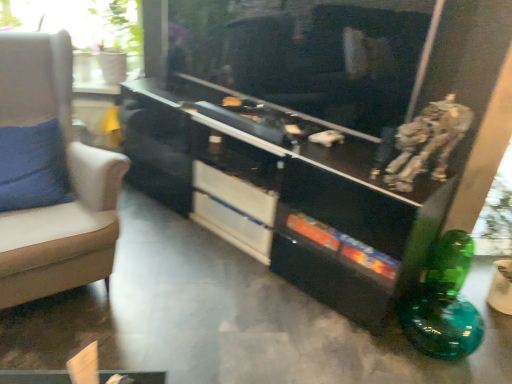
Describe the element at coordinates (85, 31) in the screenshot. I see `transparent glass window at upper left` at that location.

The height and width of the screenshot is (384, 512). What do you see at coordinates (234, 193) in the screenshot?
I see `white glossy drawer at center, which is the first drawer from top to bottom` at bounding box center [234, 193].

This screenshot has width=512, height=384. Identify the location of white glossy drawer at center, arranged as the first drawer when ordered from the bottom. (233, 226).

From a real-world perspective, is transparent glass window at upper left positioned above or below white glossy drawer at center, arranged as the first drawer when ordered from the bottom?

Clearly, from a real-world perspective, transparent glass window at upper left is above white glossy drawer at center, arranged as the first drawer when ordered from the bottom.

Is transparent glass window at upper left completely or partially outside of white glossy drawer at center, arranged as the first drawer when ordered from the bottom?

Yes, transparent glass window at upper left is not within white glossy drawer at center, arranged as the first drawer when ordered from the bottom.

Is transparent glass window at upper left at the right side of white glossy drawer at center, the second drawer viewed from the top?

No.

Does black glossy entertainment center at center turn towards white glossy drawer at center, which is the first drawer from top to bottom?

Yes.

Choose the correct answer: Is black glossy entertainment center at center inside white glossy drawer at center, which is the first drawer from top to bottom, or outside it?

black glossy entertainment center at center is spatially situated outside white glossy drawer at center, which is the first drawer from top to bottom.

Is black glossy entertainment center at center touching white glossy drawer at center, arranged as the 2th drawer when ordered from the bottom?

black glossy entertainment center at center is not next to white glossy drawer at center, arranged as the 2th drawer when ordered from the bottom, and they're not touching.

Looking at their sizes, would you say transparent glass window at upper left is wider or thinner than metallic silver robot at upper right?

Considering their sizes, transparent glass window at upper left looks broader than metallic silver robot at upper right.

Is transparent glass window at upper left bigger than metallic silver robot at upper right?

Yes.

Could you measure the distance between metallic silver robot at upper right and black glossy entertainment center at center?

metallic silver robot at upper right and black glossy entertainment center at center are 19.25 inches apart from each other.

Considering the sizes of objects metallic silver robot at upper right and black glossy entertainment center at center in the image provided, who is bigger, metallic silver robot at upper right or black glossy entertainment center at center?

black glossy entertainment center at center.

In order to click on animal above the black glossy entertainment center at center (from a real-world perspective) in this screenshot , I will do `click(426, 143)`.

Is metallic silver robot at upper right placed right next to black glossy entertainment center at center?

metallic silver robot at upper right is not next to black glossy entertainment center at center, and they're not touching.

Between point (414, 125) and point (47, 88), which one is positioned in front?

The point (414, 125) is in front.

How many degrees apart are the facing directions of metallic silver robot at upper right and beige fabric chair at left?

89.7 degrees separate the facing orientations of metallic silver robot at upper right and beige fabric chair at left.

Considering the positions of objects metallic silver robot at upper right and beige fabric chair at left in the image provided, who is more to the left, metallic silver robot at upper right or beige fabric chair at left?

From the viewer's perspective, beige fabric chair at left appears more on the left side.

Consider the image. Is white glossy drawer at center, the second drawer viewed from the top, surrounded by metallic silver robot at upper right?

No, white glossy drawer at center, the second drawer viewed from the top, is not surrounded by metallic silver robot at upper right.

Is metallic silver robot at upper right positioned with its back to white glossy drawer at center, arranged as the first drawer when ordered from the bottom?

metallic silver robot at upper right does not have its back to white glossy drawer at center, arranged as the first drawer when ordered from the bottom.

Is metallic silver robot at upper right taller or shorter than white glossy drawer at center, arranged as the first drawer when ordered from the bottom?

Considering their sizes, metallic silver robot at upper right has more height than white glossy drawer at center, arranged as the first drawer when ordered from the bottom.

Considering the sizes of objects white glossy drawer at center, arranged as the first drawer when ordered from the bottom, and black glossy entertainment center at center in the image provided, who is wider, white glossy drawer at center, arranged as the first drawer when ordered from the bottom, or black glossy entertainment center at center?

Wider between the two is black glossy entertainment center at center.

Is white glossy drawer at center, the second drawer viewed from the top, taller or shorter than black glossy entertainment center at center?

white glossy drawer at center, the second drawer viewed from the top, is shorter than black glossy entertainment center at center.

From a real-world perspective, which object stands above the other?

In real-world perspective, black glossy entertainment center at center is above.

Is white glossy drawer at center, arranged as the first drawer when ordered from the bottom, oriented towards black glossy entertainment center at center?

Yes, white glossy drawer at center, arranged as the first drawer when ordered from the bottom, faces towards black glossy entertainment center at center.

From the transparent glass window at upper left, count 1st drawer to the right and point to it. Please provide its 2D coordinates.

[(233, 226)]

Locate an element on the screen. The height and width of the screenshot is (384, 512). entertainment center above the white glossy drawer at center, which is the first drawer from top to bottom (from the image's perspective) is located at coordinates (283, 192).

Considering their positions, is beige fabric chair at left positioned closer to metallic silver robot at upper right than black glossy entertainment center at center?

black glossy entertainment center at center.

Estimate the real-world distances between objects in this image. Which object is closer to transparent glass window at upper left, beige fabric chair at left or white glossy drawer at center, arranged as the first drawer when ordered from the bottom?

The object closer to transparent glass window at upper left is beige fabric chair at left.

Which object lies further to the anchor point black glossy entertainment center at center, transparent glass window at upper left or metallic silver robot at upper right?

transparent glass window at upper left is further to black glossy entertainment center at center.

From the image, which object appears to be nearer to white glossy drawer at center, which is the first drawer from top to bottom, beige fabric chair at left or white glossy drawer at center, the second drawer viewed from the top?

Based on the image, white glossy drawer at center, the second drawer viewed from the top, appears to be nearer to white glossy drawer at center, which is the first drawer from top to bottom.

Estimate the real-world distances between objects in this image. Which object is further from white glossy drawer at center, arranged as the first drawer when ordered from the bottom, transparent glass window at upper left or beige fabric chair at left?

transparent glass window at upper left is further to white glossy drawer at center, arranged as the first drawer when ordered from the bottom.

When comparing their distances from black glossy entertainment center at center, does metallic silver robot at upper right or transparent glass window at upper left seem further?

transparent glass window at upper left is further to black glossy entertainment center at center.

Considering their positions, is white glossy drawer at center, which is the first drawer from top to bottom, positioned closer to metallic silver robot at upper right than white glossy drawer at center, the second drawer viewed from the top?

Based on the image, white glossy drawer at center, which is the first drawer from top to bottom, appears to be nearer to metallic silver robot at upper right.

Estimate the real-world distances between objects in this image. Which object is closer to transparent glass window at upper left, beige fabric chair at left or metallic silver robot at upper right?

Based on the image, beige fabric chair at left appears to be nearer to transparent glass window at upper left.

Find the location of `entertainment center between beige fabric chair at left and metallic silver robot at upper right in the horizontal direction`. entertainment center between beige fabric chair at left and metallic silver robot at upper right in the horizontal direction is located at coordinates (283, 192).

At what (x,y) coordinates should I click in order to perform the action: click on entertainment center located between white glossy drawer at center, which is the first drawer from top to bottom, and metallic silver robot at upper right in the left-right direction. Please return your answer as a coordinate pair (x, y). This screenshot has height=384, width=512. Looking at the image, I should click on (283, 192).

Find the location of a particular element. entertainment center located between white glossy drawer at center, the second drawer viewed from the top, and metallic silver robot at upper right in the left-right direction is located at coordinates (283, 192).

You are a GUI agent. You are given a task and a screenshot of the screen. Output one action in this format:
    pyautogui.click(x=<x>, y=<y>)
    Task: Click on the entertainment center between beige fabric chair at left and white glossy drawer at center, the second drawer viewed from the top, along the z-axis
    
    Given the screenshot: What is the action you would take?
    pyautogui.click(x=283, y=192)